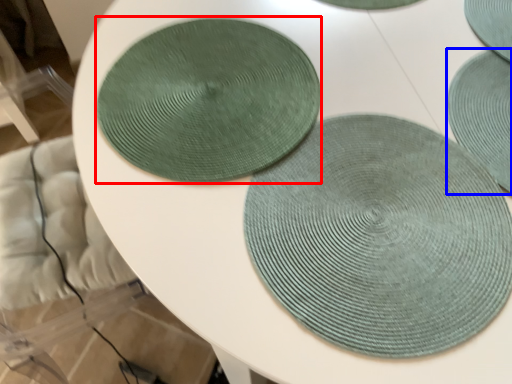
Question: Which point is further to the camera, coaster (highlighted by a red box) or mat (highlighted by a blue box)?

Choices:
 (A) coaster
 (B) mat

Answer: (A)